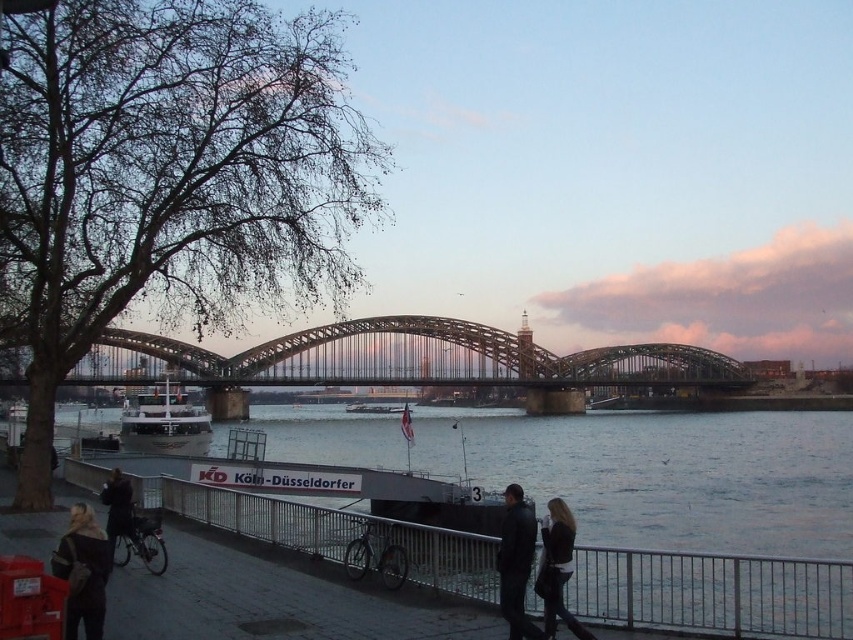
How much distance is there between metallic steel bridge at center and dark gray leather jacket at center?

metallic steel bridge at center is 438.09 feet from dark gray leather jacket at center.

Is metallic steel bridge at center taller than dark gray leather jacket at center?

Yes, metallic steel bridge at center is taller than dark gray leather jacket at center.

Who is more distant from viewer, (160, 356) or (518, 616)?

The point (160, 356) is more distant.

At what (x,y) coordinates should I click in order to perform the action: click on metallic steel bridge at center. Please return your answer as a coordinate pair (x, y). Looking at the image, I should click on (403, 358).

Can you confirm if blue water at lower center is wider than white glossy boat at center?

Yes.

Does blue water at lower center come behind white glossy boat at center?

No, blue water at lower center is in front of white glossy boat at center.

I want to click on blue water at lower center, so click(670, 474).

Can you confirm if brown fur coat at lower left is positioned below dark gray leather jacket at center?

Incorrect, brown fur coat at lower left is not positioned below dark gray leather jacket at center.

Between brown fur coat at lower left and dark gray leather jacket at center, which one appears on the left side from the viewer's perspective?

Positioned to the left is brown fur coat at lower left.

At what (x,y) coordinates should I click in order to perform the action: click on brown fur coat at lower left. Please return your answer as a coordinate pair (x, y). Looking at the image, I should click on (83, 572).